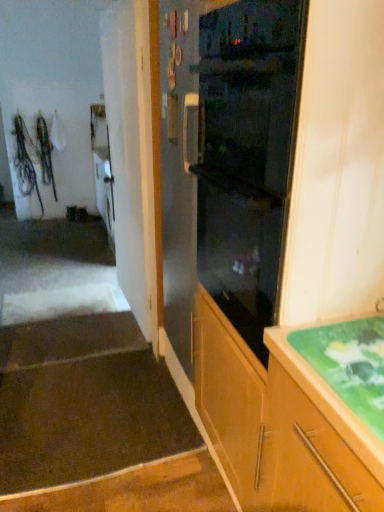
Question: Considering the relative positions of dark brown carpet at lower left, positioned as the second stairwell in back-to-front order, and brown carpet at lower left, the 2th stairwell positioned from the front, in the image provided, is dark brown carpet at lower left, positioned as the second stairwell in back-to-front order, to the left of brown carpet at lower left, the 2th stairwell positioned from the front, from the viewer's perspective?

Choices:
 (A) yes
 (B) no

Answer: (B)

Question: From a real-world perspective, is dark brown carpet at lower left, positioned as the second stairwell in back-to-front order, physically below brown carpet at lower left, the first stairwell in the back-to-front sequence?

Choices:
 (A) yes
 (B) no

Answer: (B)

Question: From the image's perspective, is dark brown carpet at lower left, positioned as the second stairwell in back-to-front order, located above brown carpet at lower left, the 2th stairwell positioned from the front?

Choices:
 (A) no
 (B) yes

Answer: (A)

Question: Is dark brown carpet at lower left, the first stairwell viewed from the front, facing towards brown carpet at lower left, the 2th stairwell positioned from the front?

Choices:
 (A) no
 (B) yes

Answer: (A)

Question: Is dark brown carpet at lower left, the first stairwell viewed from the front, located outside brown carpet at lower left, the 2th stairwell positioned from the front?

Choices:
 (A) yes
 (B) no

Answer: (A)

Question: Is point (283, 342) positioned closer to the camera than point (8, 361)?

Choices:
 (A) farther
 (B) closer

Answer: (B)

Question: From the image's perspective, is green glossy countertop at lower right above or below dark brown carpet at lower left, the first stairwell viewed from the front?

Choices:
 (A) below
 (B) above

Answer: (B)

Question: Would you say green glossy countertop at lower right is inside or outside dark brown carpet at lower left, positioned as the second stairwell in back-to-front order?

Choices:
 (A) outside
 (B) inside

Answer: (A)

Question: Is green glossy countertop at lower right bigger or smaller than dark brown carpet at lower left, the first stairwell viewed from the front?

Choices:
 (A) small
 (B) big

Answer: (A)

Question: Is black glass oven at center inside the boundaries of green glossy countertop at lower right, or outside?

Choices:
 (A) outside
 (B) inside

Answer: (A)

Question: Is point (281, 148) closer or farther from the camera than point (268, 344)?

Choices:
 (A) farther
 (B) closer

Answer: (B)

Question: Considering the positions of black glass oven at center and green glossy countertop at lower right in the image, is black glass oven at center bigger or smaller than green glossy countertop at lower right?

Choices:
 (A) small
 (B) big

Answer: (B)

Question: From a real-world perspective, is black glass oven at center above or below green glossy countertop at lower right?

Choices:
 (A) above
 (B) below

Answer: (A)

Question: Considering the positions of point (94, 387) and point (230, 243), is point (94, 387) closer or farther from the camera than point (230, 243)?

Choices:
 (A) closer
 (B) farther

Answer: (B)

Question: From a real-world perspective, is dark brown carpet at lower left, the first stairwell viewed from the front, physically located above or below black glass oven at center?

Choices:
 (A) below
 (B) above

Answer: (A)